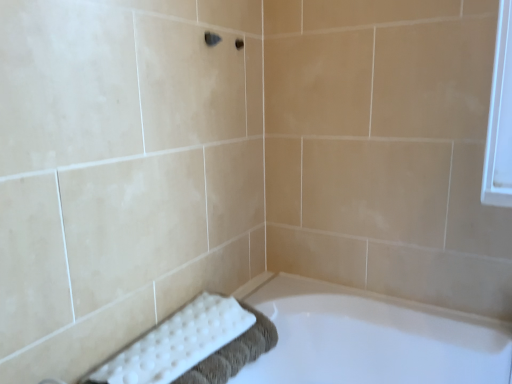
What is the approximate height of white textured bath towel at lower left?

2.52 inches.

Image resolution: width=512 pixels, height=384 pixels. What do you see at coordinates (177, 342) in the screenshot? I see `white textured bath towel at lower left` at bounding box center [177, 342].

This screenshot has width=512, height=384. I want to click on white textured bath towel at lower left, so click(177, 342).

Find the location of a particular element. The width and height of the screenshot is (512, 384). white glossy bathtub at lower center is located at coordinates pyautogui.click(x=371, y=339).

What do you see at coordinates (371, 339) in the screenshot?
I see `white glossy bathtub at lower center` at bounding box center [371, 339].

Find the location of `white textured bath towel at lower left`. white textured bath towel at lower left is located at coordinates (177, 342).

Does white textured bath towel at lower left appear on the right side of white glossy bathtub at lower center?

Incorrect, white textured bath towel at lower left is not on the right side of white glossy bathtub at lower center.

Is the position of white textured bath towel at lower left less distant than that of white glossy bathtub at lower center?

No, the depth of white textured bath towel at lower left is greater than that of white glossy bathtub at lower center.

Is point (187, 350) closer or farther from the camera than point (389, 374)?

Point (187, 350) appears to be closer to the viewer than point (389, 374).

From the image's perspective, is white textured bath towel at lower left above or below white glossy bathtub at lower center?

Based on their image positions, white textured bath towel at lower left is located above white glossy bathtub at lower center.

From a real-world perspective, is white textured bath towel at lower left on top of white glossy bathtub at lower center?

Yes.

Can you confirm if white textured bath towel at lower left is wider than white glossy bathtub at lower center?

Incorrect, the width of white textured bath towel at lower left does not surpass that of white glossy bathtub at lower center.

Between white textured bath towel at lower left and white glossy bathtub at lower center, which one has more height?

Standing taller between the two is white glossy bathtub at lower center.

Looking at this image, considering the sizes of objects white textured bath towel at lower left and white glossy bathtub at lower center in the image provided, who is bigger, white textured bath towel at lower left or white glossy bathtub at lower center?

white glossy bathtub at lower center.

Is white glossy bathtub at lower center surrounded by white textured bath towel at lower left?

Actually, white glossy bathtub at lower center is outside white textured bath towel at lower left.

Can you see white textured bath towel at lower left touching white glossy bathtub at lower center?

No, white textured bath towel at lower left is not with white glossy bathtub at lower center.

Could you tell me if white textured bath towel at lower left is facing white glossy bathtub at lower center?

No.

How much distance is there between white textured bath towel at lower left and white glossy bathtub at lower center?

A distance of 13.72 inches exists between white textured bath towel at lower left and white glossy bathtub at lower center.

The width and height of the screenshot is (512, 384). I want to click on bath towel on the left side of white glossy bathtub at lower center, so click(177, 342).

Consider the image. Considering the positions of objects white glossy bathtub at lower center and white textured bath towel at lower left in the image provided, who is more to the right, white glossy bathtub at lower center or white textured bath towel at lower left?

Positioned to the right is white glossy bathtub at lower center.

Considering the positions of objects white glossy bathtub at lower center and white textured bath towel at lower left in the image provided, who is behind, white glossy bathtub at lower center or white textured bath towel at lower left?

Positioned behind is white textured bath towel at lower left.

Which is more distant, (308, 301) or (247, 321)?

The point (308, 301) is behind.

From the image's perspective, would you say white glossy bathtub at lower center is positioned over white textured bath towel at lower left?

No.

From a real-world perspective, who is located higher, white glossy bathtub at lower center or white textured bath towel at lower left?

white textured bath towel at lower left.

Looking at this image, is white glossy bathtub at lower center wider or thinner than white textured bath towel at lower left?

white glossy bathtub at lower center is wider than white textured bath towel at lower left.

Consider the image. Does white glossy bathtub at lower center have a greater height compared to white textured bath towel at lower left?

Yes, white glossy bathtub at lower center is taller than white textured bath towel at lower left.

Consider the image. Does white glossy bathtub at lower center have a larger size compared to white textured bath towel at lower left?

Yes, white glossy bathtub at lower center is bigger than white textured bath towel at lower left.

Is white glossy bathtub at lower center not within white textured bath towel at lower left?

white glossy bathtub at lower center is positioned outside white textured bath towel at lower left.

Is white glossy bathtub at lower center far away from white textured bath towel at lower left?

No.

Is white glossy bathtub at lower center turned away from white textured bath towel at lower left?

white glossy bathtub at lower center does not have its back to white textured bath towel at lower left.

Can you tell me how much white glossy bathtub at lower center and white textured bath towel at lower left differ in facing direction?

90 degrees.

Identify the location of bath towel located on the left of white glossy bathtub at lower center. Image resolution: width=512 pixels, height=384 pixels. (177, 342).

Locate an element on the screen. bath towel above the white glossy bathtub at lower center (from the image's perspective) is located at coordinates (177, 342).

Identify the location of bathtub below the white textured bath towel at lower left (from the image's perspective). The height and width of the screenshot is (384, 512). (371, 339).